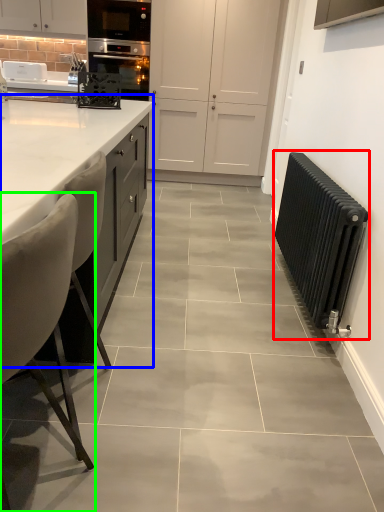
Question: Which object is the closest to the radiator (highlighted by a red box)? Choose among these: countertop (highlighted by a blue box) or chair (highlighted by a green box).

Choices:
 (A) countertop
 (B) chair

Answer: (A)